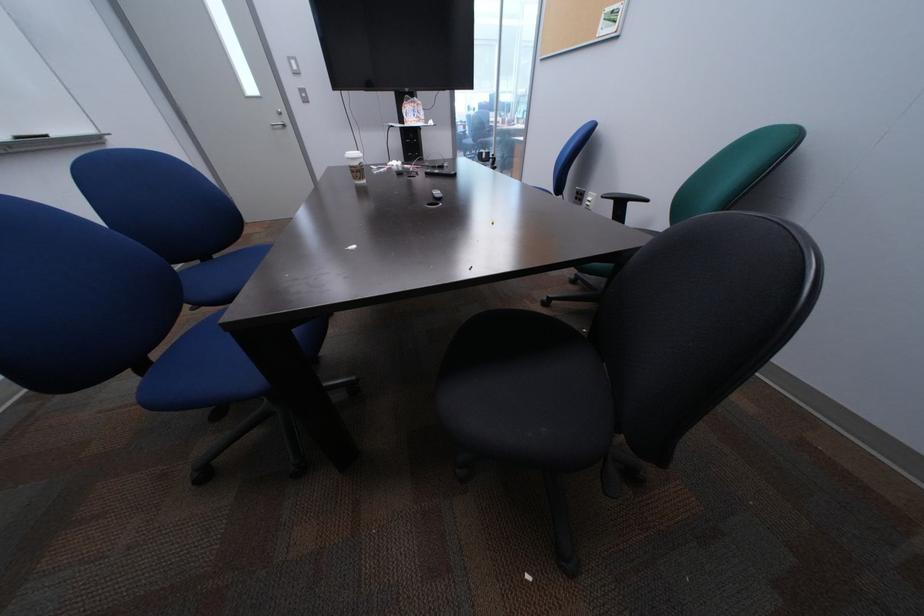
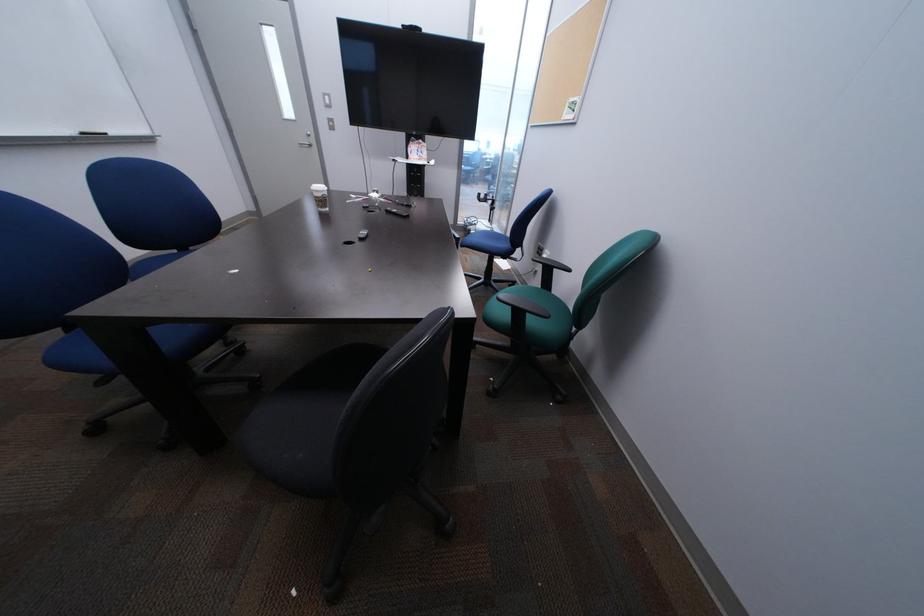
Question: Based on the continuous images, in which direction is the camera rotating? Reply with the corresponding letter.

Choices:
 (A) Left
 (B) Right
 (C) Up
 (D) Down

Answer: (A)